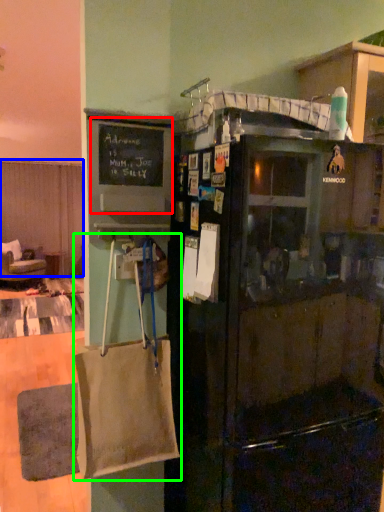
Question: Estimate the real-world distances between objects in this image. Which object is farther from bulletin board (highlighted by a red box), curtain (highlighted by a blue box) or grocery bag (highlighted by a green box)?

Choices:
 (A) curtain
 (B) grocery bag

Answer: (A)